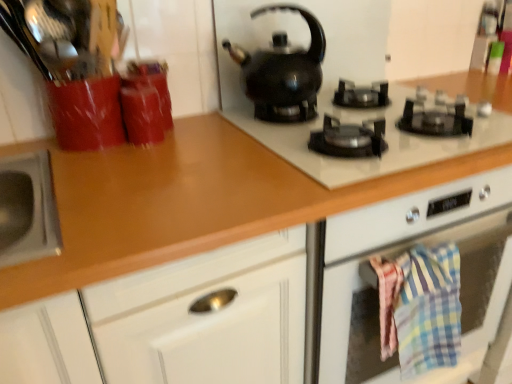
Question: Can we say black glossy gas stove at upper center lies outside black glossy kettle at upper center?

Choices:
 (A) no
 (B) yes

Answer: (B)

Question: Is black glossy gas stove at upper center shorter than black glossy kettle at upper center?

Choices:
 (A) no
 (B) yes

Answer: (B)

Question: Is black glossy gas stove at upper center next to black glossy kettle at upper center and touching it?

Choices:
 (A) yes
 (B) no

Answer: (B)

Question: From a real-world perspective, is black glossy gas stove at upper center located higher than black glossy kettle at upper center?

Choices:
 (A) no
 (B) yes

Answer: (A)

Question: Can you confirm if black glossy gas stove at upper center is wider than black glossy kettle at upper center?

Choices:
 (A) no
 (B) yes

Answer: (B)

Question: Is black glossy gas stove at upper center not near black glossy kettle at upper center?

Choices:
 (A) yes
 (B) no

Answer: (B)

Question: Can you confirm if plaid cotton towel at lower right is wider than black glossy gas stove at upper center?

Choices:
 (A) no
 (B) yes

Answer: (A)

Question: Would you say black glossy gas stove at upper center is part of plaid cotton towel at lower right's contents?

Choices:
 (A) no
 (B) yes

Answer: (A)

Question: Is the position of plaid cotton towel at lower right more distant than that of black glossy gas stove at upper center?

Choices:
 (A) yes
 (B) no

Answer: (A)

Question: Considering the relative positions of plaid cotton towel at lower right and black glossy gas stove at upper center in the image provided, is plaid cotton towel at lower right to the right of black glossy gas stove at upper center from the viewer's perspective?

Choices:
 (A) no
 (B) yes

Answer: (B)

Question: From the image's perspective, does plaid cotton towel at lower right appear lower than black glossy gas stove at upper center?

Choices:
 (A) no
 (B) yes

Answer: (B)

Question: Is plaid cotton towel at lower right bigger than black glossy gas stove at upper center?

Choices:
 (A) no
 (B) yes

Answer: (A)

Question: Can you confirm if black glossy gas stove at upper center is shorter than brown glossy countertop at center?

Choices:
 (A) no
 (B) yes

Answer: (B)